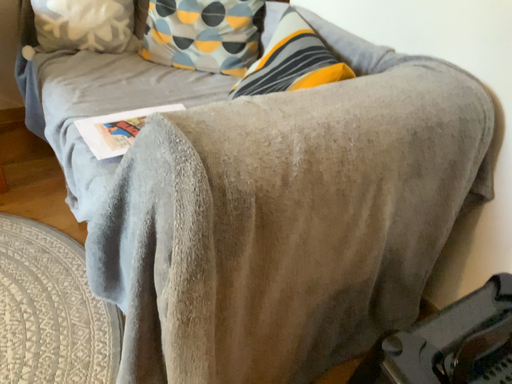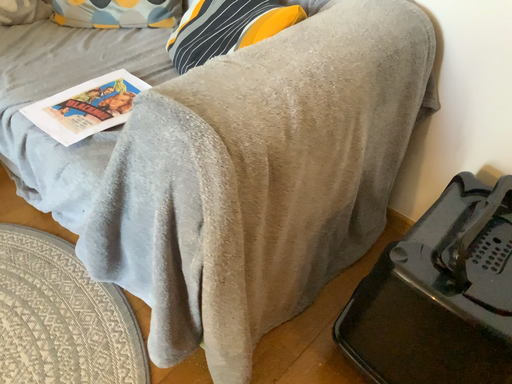
Question: Which way did the camera rotate in the video?

Choices:
 (A) rotated upward
 (B) rotated downward

Answer: (B)